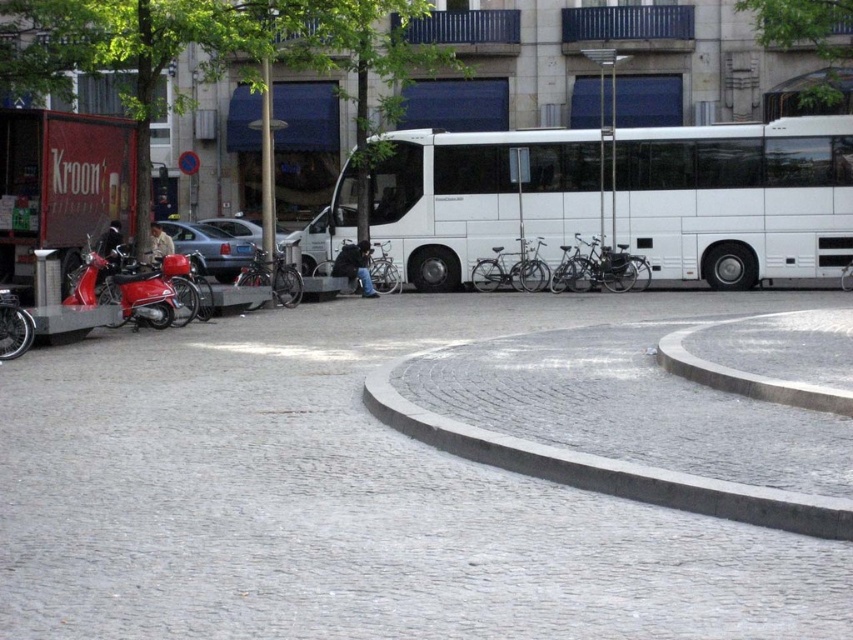
You are a delivery person trying to navigate through the urban scene. You need to move from the gray cobblestone pavement at center to the gray concrete curb at lower center. Which direction should you move to reach the curb?

To reach the gray concrete curb at lower center from the gray cobblestone pavement at center, you should move to the right since the gray cobblestone pavement at center is positioned on the left side of the gray concrete curb at lower center.

You are standing at the origin point of the coordinate system in the image. The white glossy bus at center is located at point 0.312, 0.865. If you want to walk towards the bus, which direction should you move in terms of the coordinate system?

To reach the white glossy bus at center located at coordinates [737,198] from the origin, you should move towards increasing x and y directions since both coordinates are positive.

You are a delivery person who needs to unload a package from a truck that is parked behind the white glossy bus at center. The truck is as tall as the gray cobblestone pavement at center. Can the truck pass under the bus without hitting it?

The gray cobblestone pavement at center is not as tall as the white glossy bus at center. Since the truck is as tall as the pavement, it is shorter than the bus. Therefore, the truck can safely pass under the white glossy bus at center without hitting it.